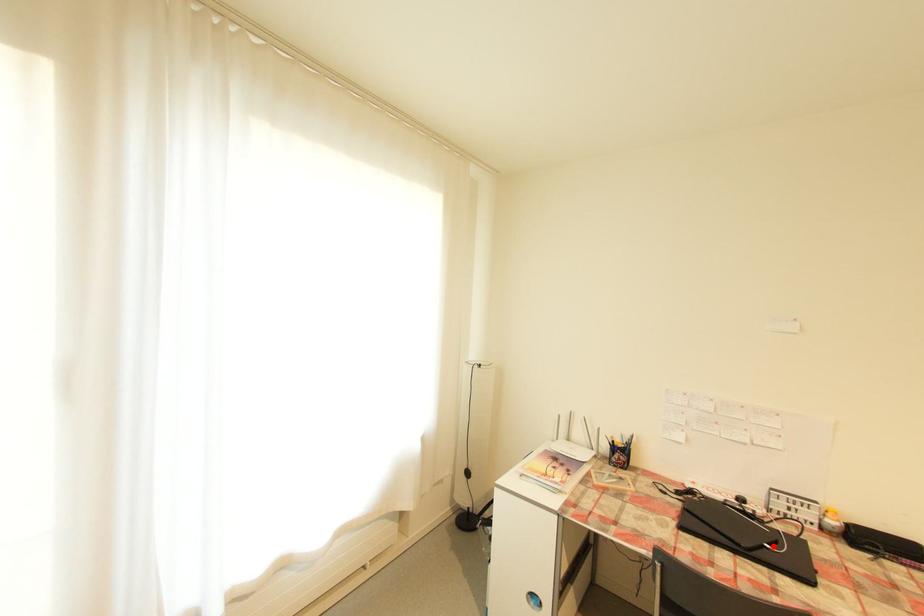
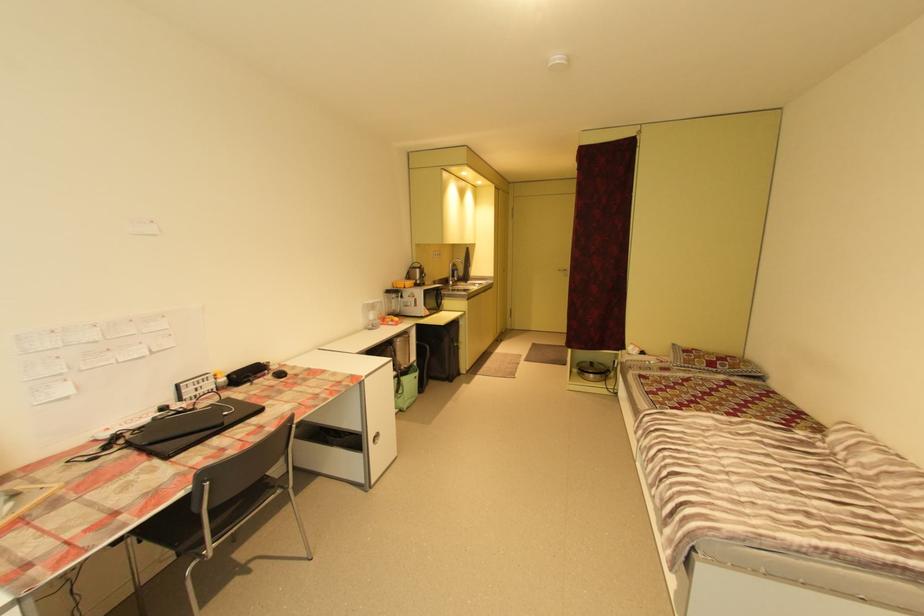
Find the pixel in the second image that matches the highlighted location in the first image.

(232, 414)